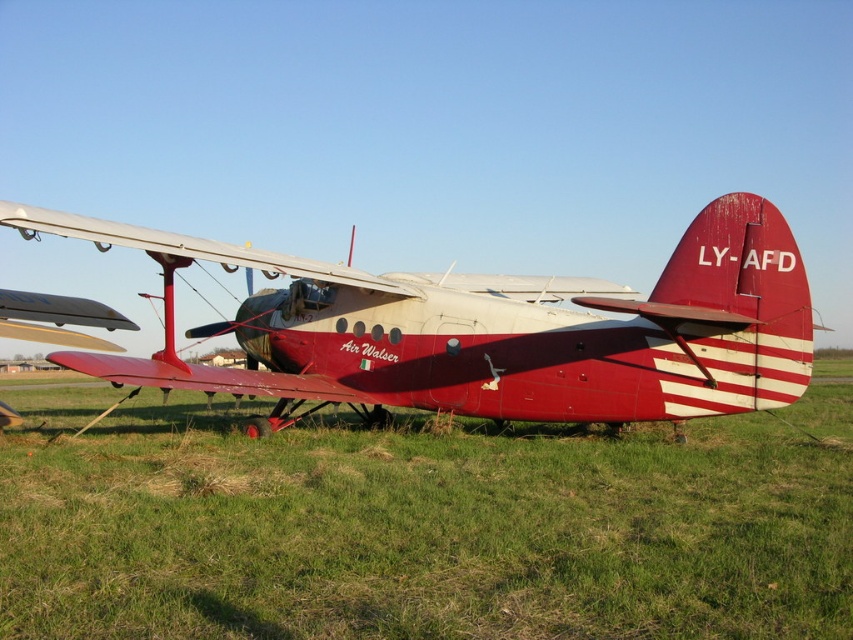
Based on the photo, you are standing at the center of the image and want to walk towards the vintage aircraft. Which direction should you head to avoid the green grass at lower center?

The green grass at lower center is located at point (421, 524), so you should head towards the vintage aircraft while avoiding the area near those coordinates to stay clear of the grass.

You are standing 10 feet away from the vintage aircraft. If you walk towards the point at coordinates point (199, 477), will you get closer to the aircraft?

The distance of point (199, 477) from camera is 16.31 feet. Since you are currently 10 feet away from the aircraft, walking towards that point would take you further away from the aircraft.

You are a photographer trying to capture the matte red airplane at center. You want to ensure the green grass at lower center fills the foreground without overwhelming the airplane. Given their sizes, is this possible?

The green grass at lower center has a larger size compared to the matte red airplane at center, so it might overwhelm the airplane in the foreground. Adjust your camera angle or position to balance their sizes in the frame.